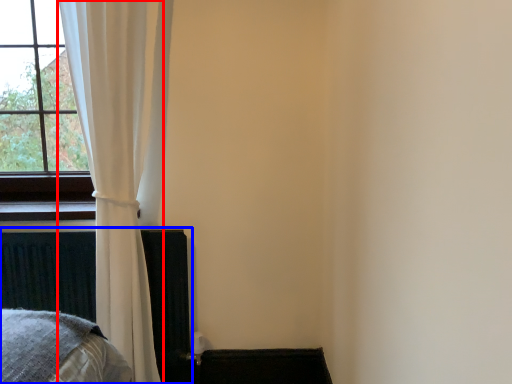
Question: Which point is closer to the camera, curtain (highlighted by a red box) or bed frame (highlighted by a blue box)?

Choices:
 (A) curtain
 (B) bed frame

Answer: (A)